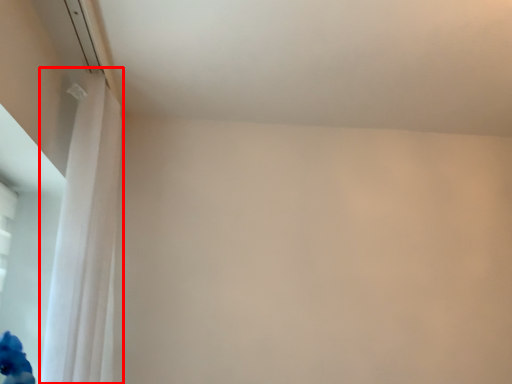
Question: Observing the image, what is the correct spatial positioning of curtain (annotated by the red box) in reference to window screen?

Choices:
 (A) left
 (B) right

Answer: (B)